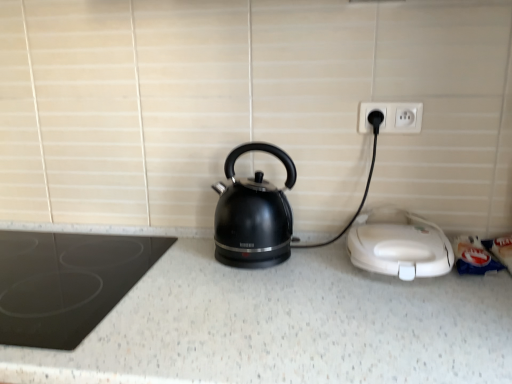
Question: Relative to white plastic sandwich maker at lower right, which is the first home appliance in right-to-left order, is white plastic outlet at upper right in front or behind?

Choices:
 (A) front
 (B) behind

Answer: (B)

Question: In terms of width, does white plastic outlet at upper right look wider or thinner when compared to white plastic sandwich maker at lower right, placed as the second home appliance when sorted from left to right?

Choices:
 (A) wide
 (B) thin

Answer: (B)

Question: Estimate the real-world distances between objects in this image. Which object is closer to the white plastic sandwich maker at lower right, which is the first home appliance in right-to-left order?

Choices:
 (A) white plastic outlet at upper right
 (B) black glossy kettle at center
 (C) white speckled granite at center
 (D) black glass cooktop at left, placed as the second home appliance when sorted from right to left

Answer: (C)

Question: Which object is the farthest from the white plastic sandwich maker at lower right, placed as the second home appliance when sorted from left to right?

Choices:
 (A) black glossy kettle at center
 (B) black glass cooktop at left, placed as the second home appliance when sorted from right to left
 (C) white speckled granite at center
 (D) white plastic outlet at upper right

Answer: (B)